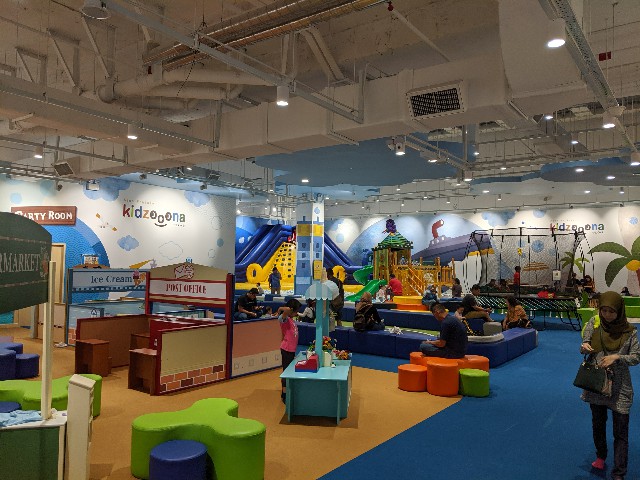
Identify the location of air duct. Image resolution: width=640 pixels, height=480 pixels. (436, 106).